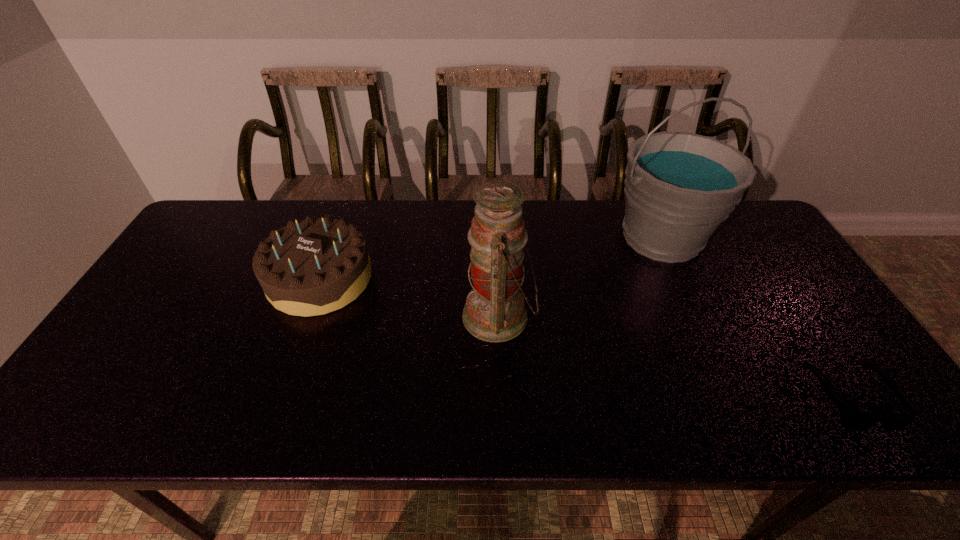
Locate an element on the screen. The width and height of the screenshot is (960, 540). unoccupied area between the oil lamp and the sunglasses is located at coordinates (674, 357).

Where is `free point between the third object from left to right and the oil lamp`? free point between the third object from left to right and the oil lamp is located at coordinates (580, 277).

Locate an element on the screen. free point between the leftmost object and the sunglasses is located at coordinates pyautogui.click(x=585, y=338).

Where is `free space that is in between the third tallest object and the oil lamp`? This screenshot has width=960, height=540. free space that is in between the third tallest object and the oil lamp is located at coordinates (409, 298).

Locate an element on the screen. This screenshot has width=960, height=540. blank region between the sunglasses and the second shortest object is located at coordinates (585, 338).

At what (x,y) coordinates should I click in order to perform the action: click on vacant area between the second object from left to right and the second object from right to left. Please return your answer as a coordinate pair (x, y). Looking at the image, I should click on (580, 277).

Identify the location of free spot between the oil lamp and the birthday cake. The image size is (960, 540). [409, 298].

Identify the location of free space that is in between the oil lamp and the birthday cake. The image size is (960, 540). (409, 298).

Where is `the closest object to the bucket`? Image resolution: width=960 pixels, height=540 pixels. the closest object to the bucket is located at coordinates (494, 311).

At what (x,y) coordinates should I click in order to perform the action: click on object that stands as the second closest to the third object from left to right. Please return your answer as a coordinate pair (x, y). Looking at the image, I should click on (855, 421).